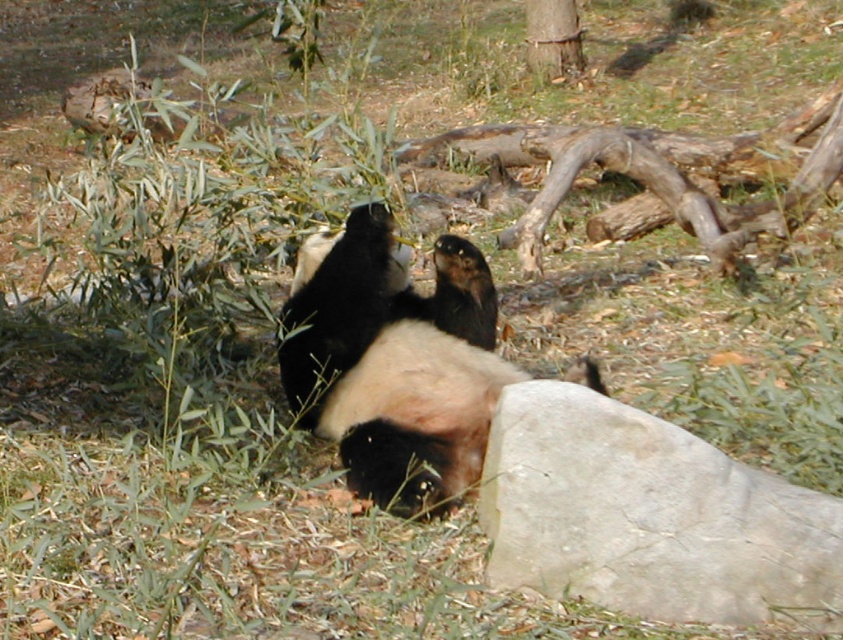
Question: Which object appears closest to the camera in this image?

Choices:
 (A) smooth brown tree trunk at upper center
 (B) black fur panda at center

Answer: (B)

Question: Does black fur panda at center have a lesser width compared to smooth brown tree trunk at upper center?

Choices:
 (A) no
 (B) yes

Answer: (A)

Question: Among these objects, which one is farthest from the camera?

Choices:
 (A) gray rough rock at lower right
 (B) smooth brown tree trunk at upper center
 (C) black fur panda at center

Answer: (B)

Question: Among these objects, which one is nearest to the camera?

Choices:
 (A) smooth brown tree trunk at upper center
 (B) gray rough rock at lower right
 (C) black fur panda at center

Answer: (B)

Question: Considering the relative positions of black fur panda at center and smooth brown tree trunk at upper center in the image provided, where is black fur panda at center located with respect to smooth brown tree trunk at upper center?

Choices:
 (A) above
 (B) below

Answer: (B)

Question: Is gray rough rock at lower right thinner than smooth brown tree trunk at upper center?

Choices:
 (A) no
 (B) yes

Answer: (A)